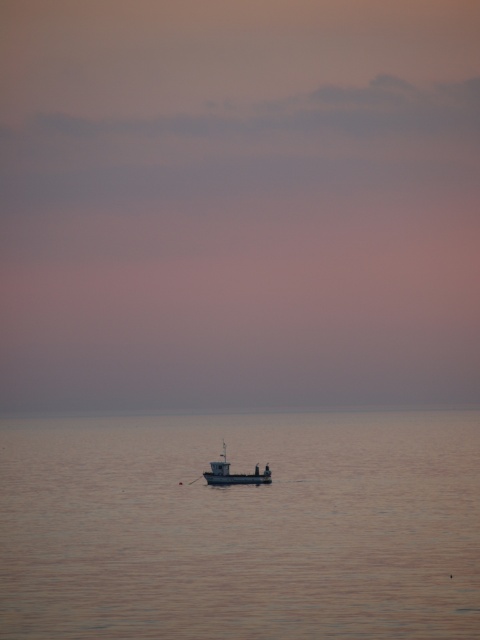
You are a sailor navigating a small boat in the middle of the ocean. You need to drop an anchor into the smooth water at center. According to the coordinates provided, where should you aim to drop the anchor?

You should aim to drop the anchor at the coordinates point (240, 525) where the smooth water at center is located.

You are a sailor on the metallic gray boat at center. You want to check the water condition below your boat. Is the smooth water at center under your boat?

Yes, the smooth water at center is located below the metallic gray boat at center, so it is under your boat.